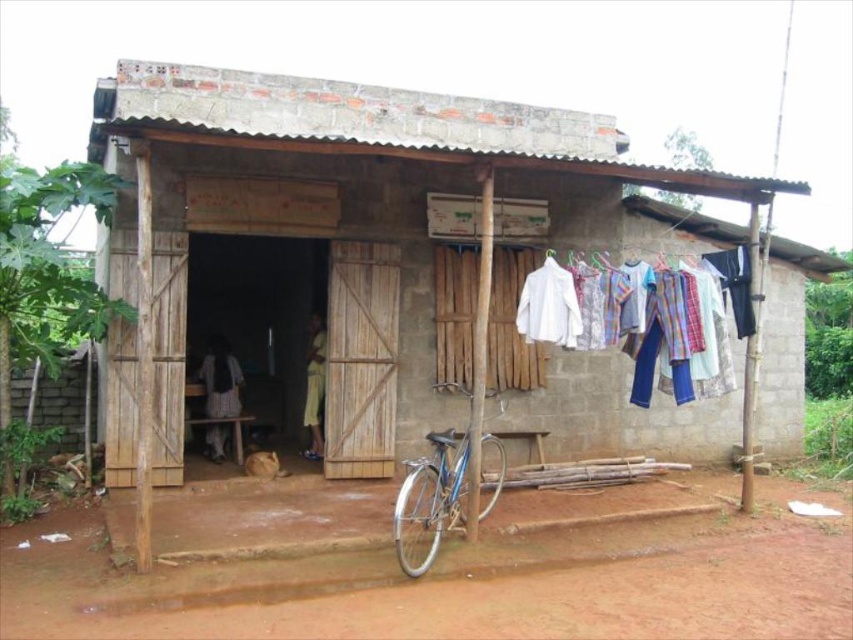
Who is more distant from viewer, (630,298) or (430,557)?

The point (630,298) is behind.

Is white cotton shirts at center thinner than blue metallic bicycle at lower center?

No, white cotton shirts at center is not thinner than blue metallic bicycle at lower center.

Where is `white cotton shirts at center`? The height and width of the screenshot is (640, 853). white cotton shirts at center is located at coordinates (622, 316).

Identify the location of white cotton shirts at center. Image resolution: width=853 pixels, height=640 pixels. (622, 316).

Does brown wooden hut at center have a smaller size compared to white cotton shirts at center?

Indeed, brown wooden hut at center has a smaller size compared to white cotton shirts at center.

Is brown wooden hut at center closer to the viewer compared to white cotton shirts at center?

No, it is not.

Is point (503, 147) positioned after point (668, 296)?

Yes, point (503, 147) is behind point (668, 296).

The width and height of the screenshot is (853, 640). I want to click on brown wooden hut at center, so click(x=403, y=262).

Between brown wooden hut at center and blue metallic bicycle at lower center, which one has more height?

brown wooden hut at center is taller.

Can you confirm if brown wooden hut at center is positioned to the left of blue metallic bicycle at lower center?

Indeed, brown wooden hut at center is positioned on the left side of blue metallic bicycle at lower center.

Which is behind, point (325, 145) or point (456, 513)?

The point (456, 513) is behind.

Identify the location of brown wooden hut at center. (403, 262).